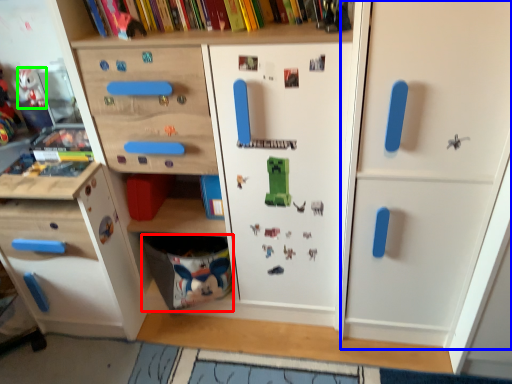
Question: Which object is positioned closest to drawer (highlighted by a red box)? Select from door (highlighted by a blue box) and toy (highlighted by a green box).

Choices:
 (A) door
 (B) toy

Answer: (A)